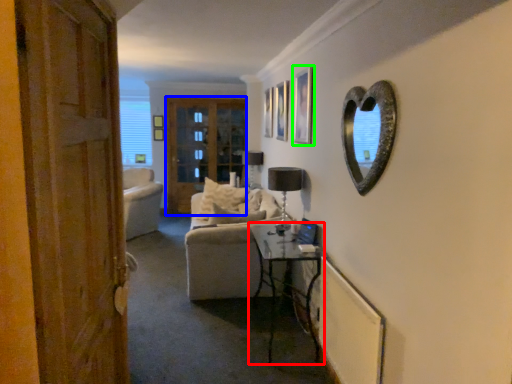
Question: Considering the real-world distances, which object is closest to table (highlighted by a red box)? screen door (highlighted by a blue box) or picture frame (highlighted by a green box).

Choices:
 (A) screen door
 (B) picture frame

Answer: (B)